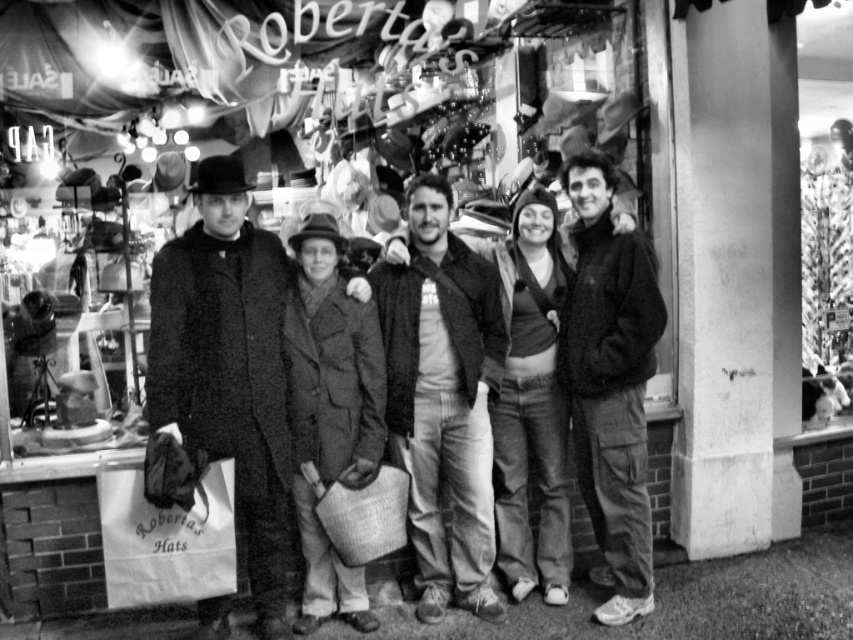
Question: Among these points, which one is farthest from the camera?

Choices:
 (A) pos(633,492)
 (B) pos(233,452)
 (C) pos(462,292)

Answer: (C)

Question: Which object is the farthest from the dark gray fleece jacket at right?

Choices:
 (A) smooth black coat at center
 (B) matte black jacket at center

Answer: (A)

Question: Does matte black jacket at center come behind dark gray fleece jacket at right?

Choices:
 (A) yes
 (B) no

Answer: (A)

Question: Is smooth black coat at center bigger than matte black jacket at center?

Choices:
 (A) yes
 (B) no

Answer: (A)

Question: Does smooth black coat at center come behind matte black jacket at center?

Choices:
 (A) yes
 (B) no

Answer: (B)

Question: Which object is farther from the camera taking this photo?

Choices:
 (A) matte black jacket at center
 (B) smooth black coat at center

Answer: (A)